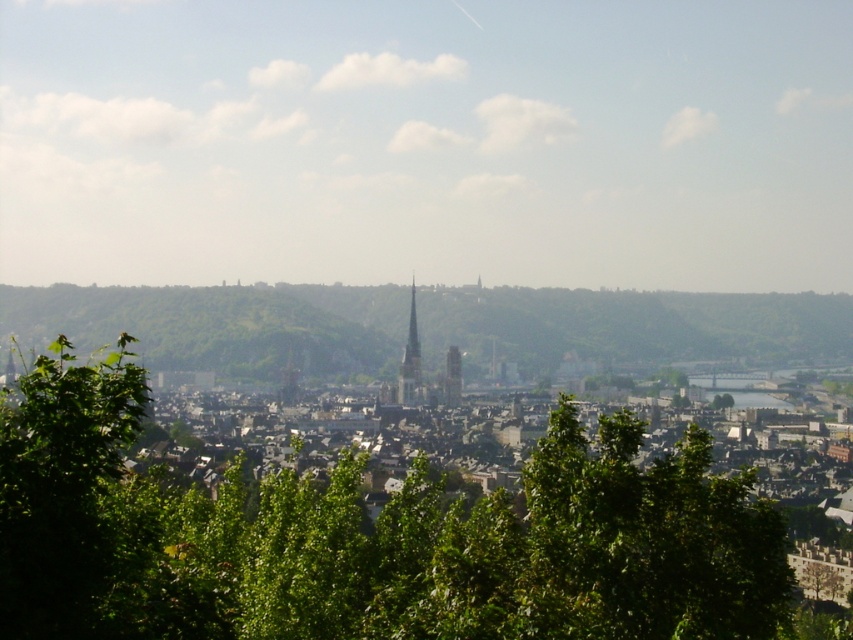
You are standing in a scenic area and want to take a photo of both the green leafy hill at center and the smooth stone tower at center. Which object should you focus on first to ensure both are in the frame?

You should focus on the smooth stone tower at center first because it is closer to you than the green leafy hill at center, which is further away. By focusing on the closer object first, you can adjust the camera to include both in the frame.

You are a city planner assessing the skyline of this historic town. You need to install a new communication tower that must be at least 60 feet away from any existing structures to comply with safety regulations. Given the current layout, can the smooth stone tower at center and the smooth gray spire at center safely accommodate this requirement?

The smooth stone tower at center and smooth gray spire at center are 50.53 feet apart, which is less than the required 60 feet for safety regulations. Therefore, the new communication tower cannot be installed between them as they are too close.

You are standing at the point marked by the coordinates point (x=221, y=324) in the image. Looking around, what do you see in the immediate vicinity?

The point (x=221, y=324) marks the green leafy hill at center, so you would see the green leafy hill around you.